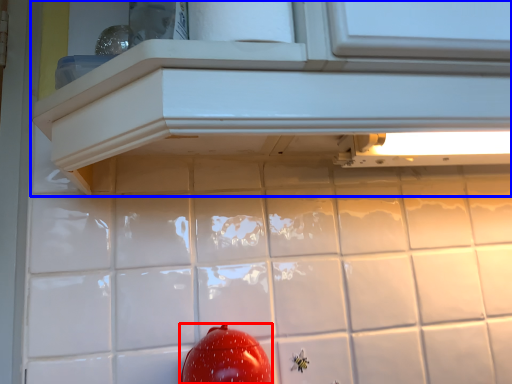
Question: Which object is closer to the camera taking this photo, tomato (highlighted by a red box) or cabinetry (highlighted by a blue box)?

Choices:
 (A) tomato
 (B) cabinetry

Answer: (B)